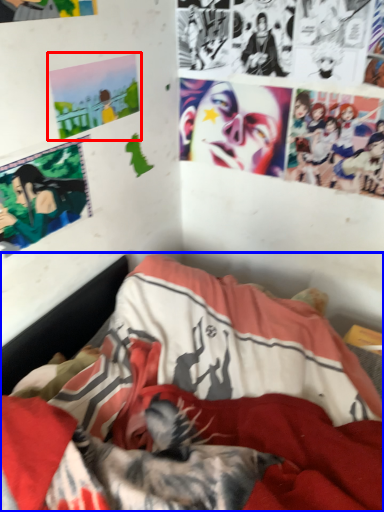
Question: Which of the following is the farthest to the observer, poster page (highlighted by a red box) or bed (highlighted by a blue box)?

Choices:
 (A) poster page
 (B) bed

Answer: (A)